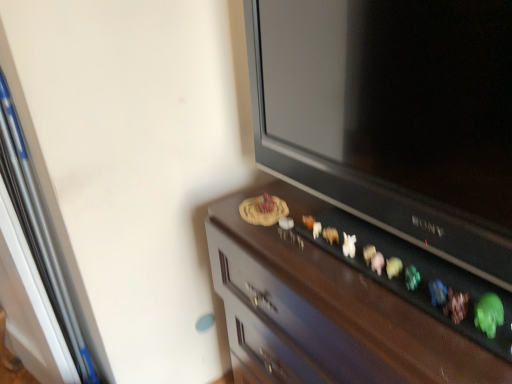
Question: Should I look upward or downward to see matte black television at upper right?

Choices:
 (A) down
 (B) up

Answer: (B)

Question: Is matte black television at upper right shorter than wooden cabinet at center?

Choices:
 (A) yes
 (B) no

Answer: (A)

Question: Is matte black television at upper right behind wooden cabinet at center?

Choices:
 (A) yes
 (B) no

Answer: (B)

Question: Can you confirm if matte black television at upper right is wider than wooden cabinet at center?

Choices:
 (A) yes
 (B) no

Answer: (B)

Question: Is matte black television at upper right oriented towards wooden cabinet at center?

Choices:
 (A) yes
 (B) no

Answer: (B)

Question: Considering the relative sizes of matte black television at upper right and wooden cabinet at center in the image provided, is matte black television at upper right taller than wooden cabinet at center?

Choices:
 (A) yes
 (B) no

Answer: (B)

Question: Does matte black television at upper right appear on the right side of wooden cabinet at center?

Choices:
 (A) yes
 (B) no

Answer: (B)

Question: Is wooden cabinet at center wider than matte black television at upper right?

Choices:
 (A) no
 (B) yes

Answer: (B)

Question: Is wooden cabinet at center not close to matte black television at upper right?

Choices:
 (A) no
 (B) yes

Answer: (A)

Question: Can we say wooden cabinet at center lies outside matte black television at upper right?

Choices:
 (A) yes
 (B) no

Answer: (A)

Question: Is wooden cabinet at center with matte black television at upper right?

Choices:
 (A) yes
 (B) no

Answer: (B)

Question: From the image's perspective, is wooden cabinet at center below matte black television at upper right?

Choices:
 (A) yes
 (B) no

Answer: (A)

Question: Is wooden cabinet at center positioned in front of matte black television at upper right?

Choices:
 (A) no
 (B) yes

Answer: (A)

Question: Looking at their shapes, would you say wooden cabinet at center is wider or thinner than matte black television at upper right?

Choices:
 (A) wide
 (B) thin

Answer: (A)